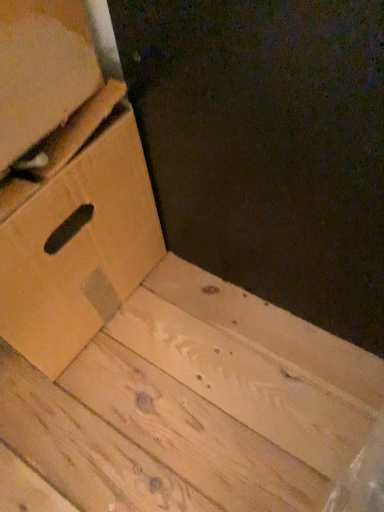
Question: Is matte cardboard box at left smaller than brown cardboard drawer at lower left?

Choices:
 (A) no
 (B) yes

Answer: (B)

Question: Is matte cardboard box at left to the left of brown cardboard drawer at lower left from the viewer's perspective?

Choices:
 (A) no
 (B) yes

Answer: (A)

Question: Could you tell me if matte cardboard box at left is turned towards brown cardboard drawer at lower left?

Choices:
 (A) yes
 (B) no

Answer: (B)

Question: Considering the relative positions of matte cardboard box at left and brown cardboard drawer at lower left in the image provided, is matte cardboard box at left to the right of brown cardboard drawer at lower left from the viewer's perspective?

Choices:
 (A) no
 (B) yes

Answer: (B)

Question: From the image's perspective, is matte cardboard box at left on top of brown cardboard drawer at lower left?

Choices:
 (A) yes
 (B) no

Answer: (A)

Question: Considering the relative sizes of matte cardboard box at left and brown cardboard drawer at lower left in the image provided, is matte cardboard box at left thinner than brown cardboard drawer at lower left?

Choices:
 (A) yes
 (B) no

Answer: (A)

Question: Is brown cardboard drawer at lower left aimed at matte cardboard box at left?

Choices:
 (A) no
 (B) yes

Answer: (A)

Question: Would you consider brown cardboard drawer at lower left to be distant from matte cardboard box at left?

Choices:
 (A) yes
 (B) no

Answer: (B)

Question: Is brown cardboard drawer at lower left wider than matte cardboard box at left?

Choices:
 (A) no
 (B) yes

Answer: (B)

Question: Can you confirm if brown cardboard drawer at lower left is shorter than matte cardboard box at left?

Choices:
 (A) yes
 (B) no

Answer: (B)

Question: Is brown cardboard drawer at lower left outside of matte cardboard box at left?

Choices:
 (A) yes
 (B) no

Answer: (A)

Question: Is brown cardboard drawer at lower left bigger than matte cardboard box at left?

Choices:
 (A) no
 (B) yes

Answer: (B)

Question: Is matte cardboard box at left wider or thinner than brown cardboard drawer at lower left?

Choices:
 (A) wide
 (B) thin

Answer: (B)